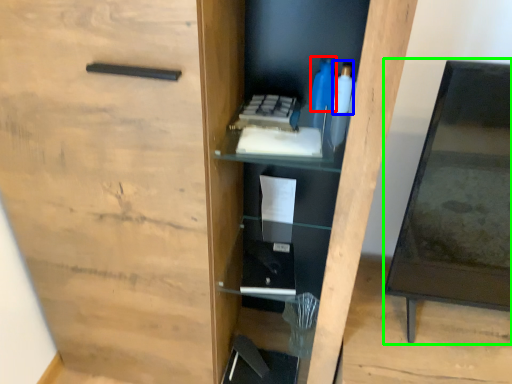
Question: Which object is positioned farthest from bottle (highlighted by a red box)? Select from bottle (highlighted by a blue box) and table (highlighted by a green box).

Choices:
 (A) bottle
 (B) table

Answer: (B)